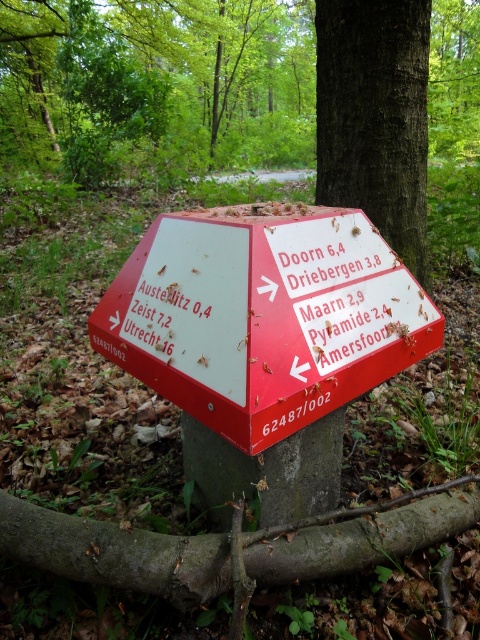
Question: Among these objects, which one is farthest from the camera?

Choices:
 (A) dark brown bark at upper center
 (B) red plastic sign at center

Answer: (A)

Question: Does red plastic sign at center lie behind dark brown bark at upper center?

Choices:
 (A) yes
 (B) no

Answer: (B)

Question: Which of the following is the farthest from the observer?

Choices:
 (A) red plastic sign at center
 (B) dark brown bark at upper center

Answer: (B)

Question: Observing the image, what is the correct spatial positioning of red plastic sign at center in reference to dark brown bark at upper center?

Choices:
 (A) left
 (B) right

Answer: (A)

Question: Does red plastic sign at center appear on the left side of dark brown bark at upper center?

Choices:
 (A) yes
 (B) no

Answer: (A)

Question: Among these points, which one is nearest to the camera?

Choices:
 (A) (184, 221)
 (B) (372, 72)

Answer: (A)